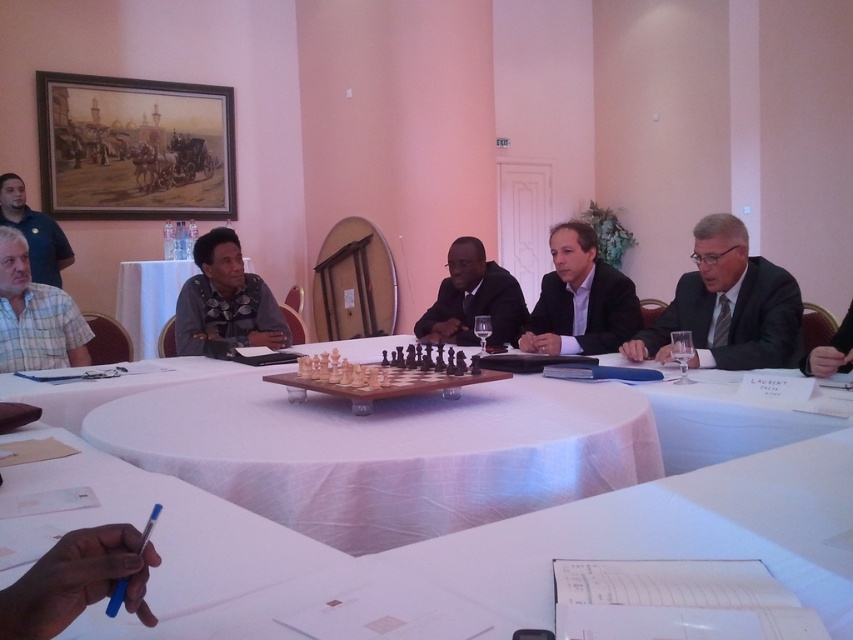
I want to click on white cloth-covered table at center, so click(592, 545).

Between white cloth-covered table at center and white plastic table at center, which one has less height?

white cloth-covered table at center is shorter.

Measure the distance between white cloth-covered table at center and camera.

white cloth-covered table at center and camera are 77.61 centimeters apart.

Identify the location of white cloth-covered table at center. (592, 545).

In the scene shown: Does wooden chess set at center appear under matte blue shirt at upper left?

Correct, wooden chess set at center is located below matte blue shirt at upper left.

Who is more distant from viewer, (390, 369) or (15, 209)?

Positioned behind is point (15, 209).

You are a GUI agent. You are given a task and a screenshot of the screen. Output one action in this format:
    pyautogui.click(x=<x>, y=<y>)
    Task: Click on the wooden chess set at center
    Image resolution: width=853 pixels, height=640 pixels.
    Given the screenshot: What is the action you would take?
    pyautogui.click(x=378, y=381)

Does white cloth-covered table at center appear under wooden chess set at center?

Yes, white cloth-covered table at center is below wooden chess set at center.

Can you confirm if white cloth-covered table at center is positioned to the right of wooden chess set at center?

Indeed, white cloth-covered table at center is positioned on the right side of wooden chess set at center.

Is point (103, 636) farther from viewer compared to point (415, 369)?

That is False.

The height and width of the screenshot is (640, 853). What are the coordinates of `white cloth-covered table at center` in the screenshot? It's located at (592, 545).